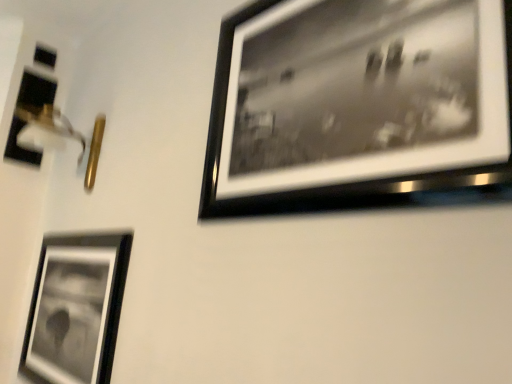
Question: Does metallic silver frame at lower left, the second picture frame when ordered from front to back, have a lesser height compared to black matte picture frame at upper right, which ranks as the first picture frame in front-to-back order?

Choices:
 (A) yes
 (B) no

Answer: (A)

Question: Is metallic silver frame at lower left, positioned as the second picture frame in right-to-left order, thinner than black matte picture frame at upper right, which ranks as the first picture frame in front-to-back order?

Choices:
 (A) no
 (B) yes

Answer: (B)

Question: Does metallic silver frame at lower left, the second picture frame when ordered from front to back, have a larger size compared to black matte picture frame at upper right, arranged as the 3th picture frame when viewed from the left?

Choices:
 (A) no
 (B) yes

Answer: (B)

Question: Is metallic silver frame at lower left, placed as the second picture frame when sorted from left to right, further to the viewer compared to black matte picture frame at upper right, which ranks as the first picture frame in front-to-back order?

Choices:
 (A) yes
 (B) no

Answer: (A)

Question: Is metallic silver frame at lower left, positioned as the second picture frame in right-to-left order, oriented away from black matte picture frame at upper right, the 1th picture frame viewed from the right?

Choices:
 (A) yes
 (B) no

Answer: (B)

Question: Is metallic silver frame at lower left, placed as the second picture frame when sorted from left to right, not close to black matte picture frame at upper right, which ranks as the third picture frame in back-to-front order?

Choices:
 (A) yes
 (B) no

Answer: (B)

Question: Is metallic silver frame at lower left, placed as the second picture frame when sorted from left to right, wider than matte black picture frame at left, arranged as the 1th picture frame when viewed from the left?

Choices:
 (A) yes
 (B) no

Answer: (B)

Question: From the image's perspective, is metallic silver frame at lower left, the second picture frame when ordered from front to back, located beneath matte black picture frame at left, arranged as the first picture frame when viewed from the back?

Choices:
 (A) yes
 (B) no

Answer: (A)

Question: Considering the relative positions of metallic silver frame at lower left, positioned as the second picture frame in right-to-left order, and matte black picture frame at left, positioned as the third picture frame in front-to-back order, in the image provided, is metallic silver frame at lower left, positioned as the second picture frame in right-to-left order, to the left of matte black picture frame at left, positioned as the third picture frame in front-to-back order, from the viewer's perspective?

Choices:
 (A) yes
 (B) no

Answer: (B)

Question: Is metallic silver frame at lower left, the second picture frame when ordered from front to back, facing towards matte black picture frame at left, arranged as the first picture frame when viewed from the back?

Choices:
 (A) no
 (B) yes

Answer: (A)

Question: Is metallic silver frame at lower left, positioned as the second picture frame in right-to-left order, positioned before matte black picture frame at left, the third picture frame viewed from the right?

Choices:
 (A) no
 (B) yes

Answer: (B)

Question: Is metallic silver frame at lower left, marked as the second picture frame in a back-to-front arrangement, placed right next to matte black picture frame at left, arranged as the 1th picture frame when viewed from the left?

Choices:
 (A) yes
 (B) no

Answer: (B)

Question: Could you tell me if black matte picture frame at upper right, the 1th picture frame viewed from the right, is facing matte black picture frame at left, arranged as the 1th picture frame when viewed from the left?

Choices:
 (A) no
 (B) yes

Answer: (A)